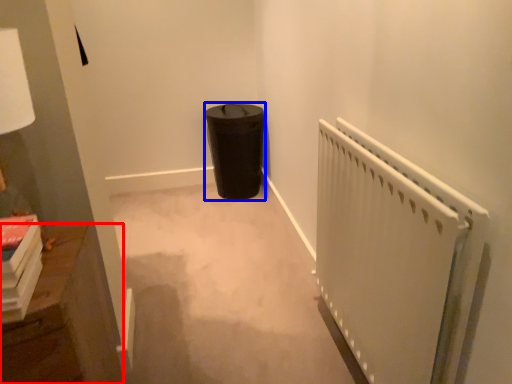
Question: Which object is closer to the camera taking this photo, furniture (highlighted by a red box) or garbage (highlighted by a blue box)?

Choices:
 (A) furniture
 (B) garbage

Answer: (A)